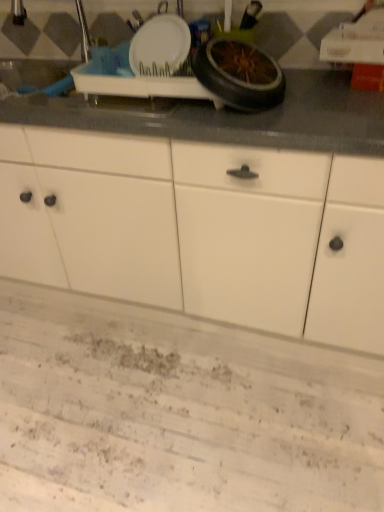
Question: Does white matte cabinet at center have a larger size compared to black rubber wheel at upper center?

Choices:
 (A) yes
 (B) no

Answer: (A)

Question: From a real-world perspective, is white matte cabinet at center below black rubber wheel at upper center?

Choices:
 (A) yes
 (B) no

Answer: (A)

Question: Is white matte cabinet at center not within black rubber wheel at upper center?

Choices:
 (A) yes
 (B) no

Answer: (A)

Question: Is white matte cabinet at center at the left side of black rubber wheel at upper center?

Choices:
 (A) no
 (B) yes

Answer: (B)

Question: From the image's perspective, would you say white matte cabinet at center is shown under black rubber wheel at upper center?

Choices:
 (A) no
 (B) yes

Answer: (B)

Question: Is the position of white matte cabinet at center more distant than that of black rubber wheel at upper center?

Choices:
 (A) yes
 (B) no

Answer: (B)

Question: Is black rubber wheel at upper center placed right next to white matte cabinet at center?

Choices:
 (A) no
 (B) yes

Answer: (A)

Question: Is black rubber wheel at upper center outside white matte cabinet at center?

Choices:
 (A) yes
 (B) no

Answer: (A)

Question: Is black rubber wheel at upper center oriented towards white matte cabinet at center?

Choices:
 (A) yes
 (B) no

Answer: (B)

Question: Is white matte cabinet at center a part of black rubber wheel at upper center?

Choices:
 (A) no
 (B) yes

Answer: (A)

Question: Is black rubber wheel at upper center looking in the opposite direction of white matte cabinet at center?

Choices:
 (A) yes
 (B) no

Answer: (B)

Question: Considering the relative positions of black rubber wheel at upper center and white matte cabinet at center in the image provided, is black rubber wheel at upper center behind white matte cabinet at center?

Choices:
 (A) no
 (B) yes

Answer: (B)

Question: Visually, is white matte cabinet at center positioned to the left or to the right of black rubber wheel at upper center?

Choices:
 (A) left
 (B) right

Answer: (A)